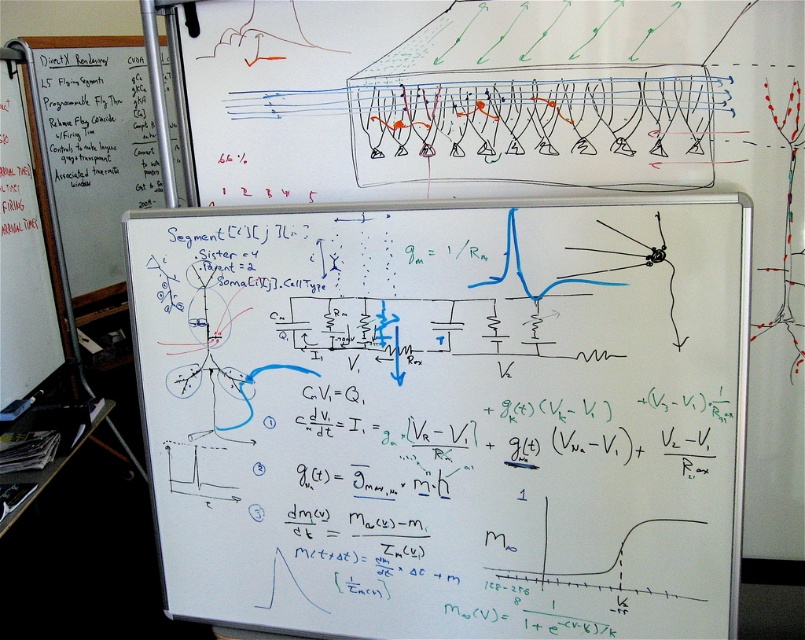
Measure the distance between whiteboard at center and camera.

They are 3.47 feet apart.

Is point (684, 438) in front of point (56, 125)?

Yes, point (684, 438) is in front of point (56, 125).

Which is behind, point (477, 573) or point (112, 240)?

Point (112, 240)

Where is `whiteboard at center`? The height and width of the screenshot is (640, 805). whiteboard at center is located at coordinates (446, 416).